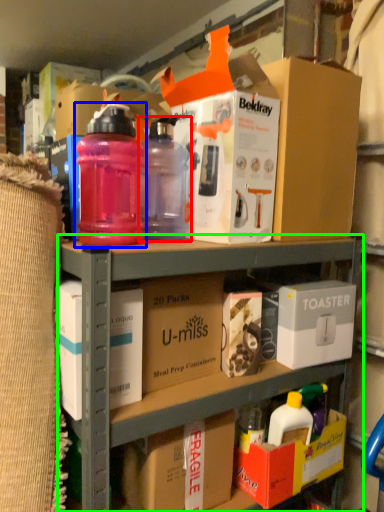
Question: Which object is positioned closest to bottle (highlighted by a red box)? Select from bottle (highlighted by a blue box) and shelf (highlighted by a green box).

Choices:
 (A) bottle
 (B) shelf

Answer: (A)